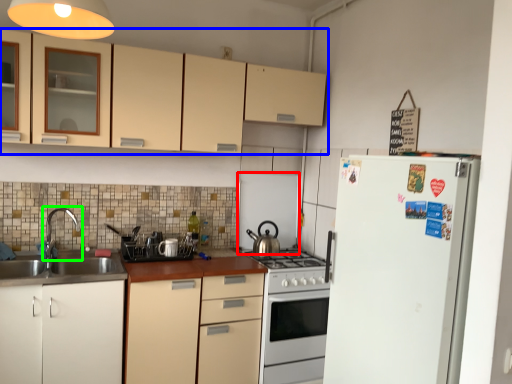
Question: Considering the real-world distances, which object is farthest from appliance (highlighted by a red box)? cabinetry (highlighted by a blue box) or tap (highlighted by a green box)?

Choices:
 (A) cabinetry
 (B) tap

Answer: (B)